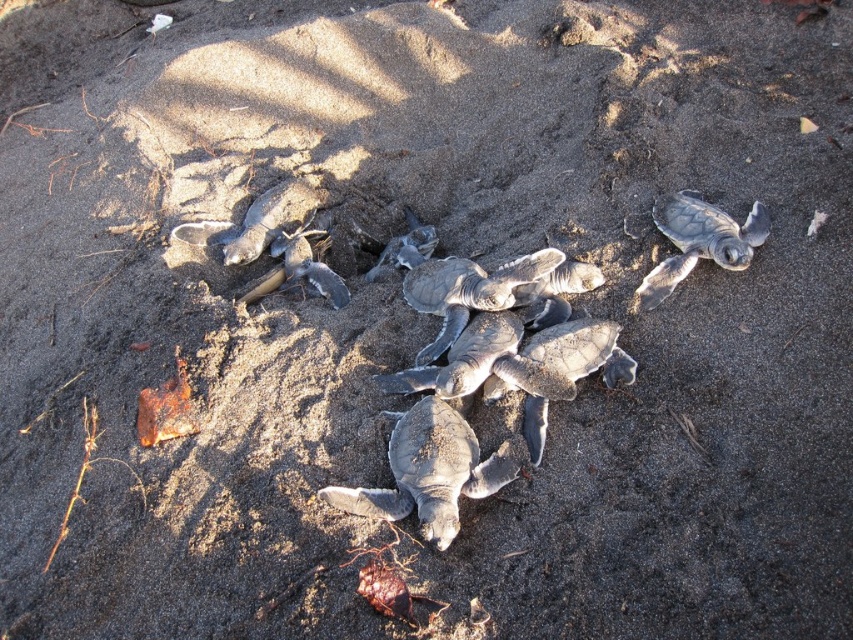
From the picture: You are a wildlife photographer aiming to capture a photo of the gray matte turtle at center and the gray matte turtle at upper right. Based on their positions, which turtle should you focus on first to ensure both are in the frame without moving the camera?

You should focus on the gray matte turtle at upper right first because the gray matte turtle at center is to the left of it, so by centering the upper right turtle in the frame, the turtle at center will naturally be included to its left without needing to adjust the camera position.

You are a researcher studying turtle nesting sites. You have a map of the beach with coordinates. You see the gray matte turtles at center. What are their coordinates on the map?

The gray matte turtles at center are located at coordinates point (468,300).

You are standing on the beach observing the baby sea turtles. There are two points marked on the sand, one at coordinates point (x=352, y=500) and another at point (x=701, y=232). Which of these points is nearer to your current position?

Point (x=352, y=500) is closer to the viewer than point (x=701, y=232), so the point at coordinates point (x=352, y=500) is nearer to your current position.